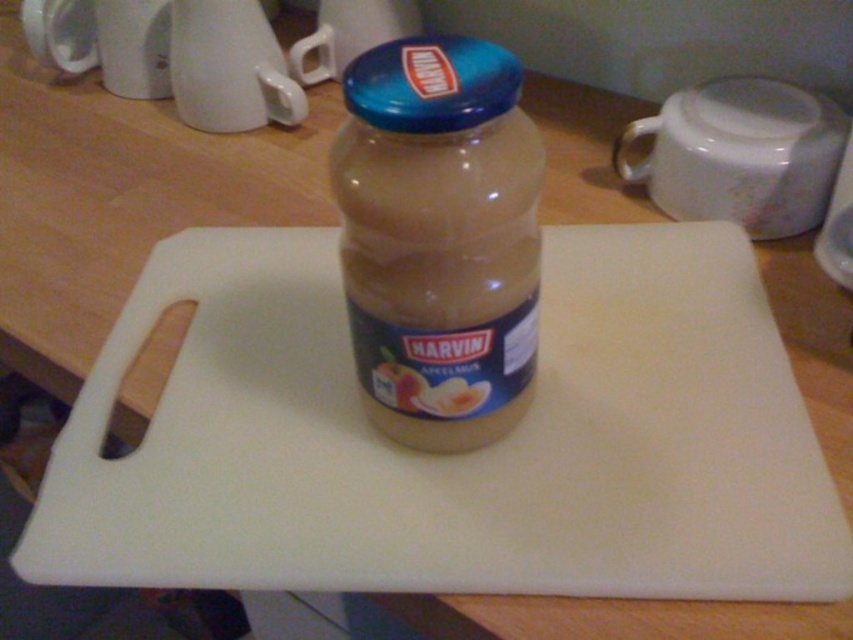
You are looking at the jar of Harvin apple jam on the cutting board. There are two points marked in the image. The first point is at coordinate (474,72) and the second is at (369,360). Which point is closer to you?

The point at coordinate (474,72) is closer to the camera than the point at (369,360).

You are packing a picnic basket and have both the white glossy mug at upper right and the matte plastic jar at center. If you want to maximize the number of items you can fit in the basket, which item should you leave behind?

The white glossy mug at upper right is larger in size than the matte plastic jar at center, so you should leave the white glossy mug at upper right behind to maximize space for more items.